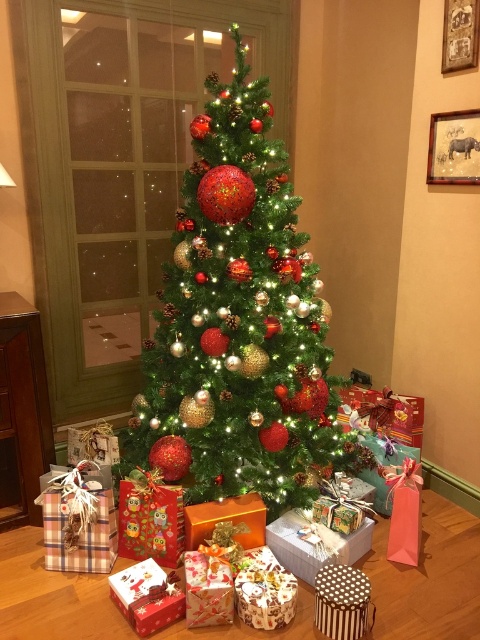
Question: Among these objects, which one is nearest to the camera?

Choices:
 (A) gold shiny gift at center
 (B) patterned paper gift at center
 (C) plaid fabric gift at lower left
 (D) shiny metallic tree at center

Answer: (B)

Question: Among these points, which one is nearest to the camera?

Choices:
 (A) (168, 620)
 (B) (123, 552)

Answer: (A)

Question: Is plaid fabric gift at lower left below patterned paper gift at center?

Choices:
 (A) no
 (B) yes

Answer: (A)

Question: Can you confirm if patterned paper gift at center is wider than gold shiny gift at center?

Choices:
 (A) yes
 (B) no

Answer: (B)

Question: Which of the following is the farthest from the observer?

Choices:
 (A) gold shiny gift at center
 (B) patterned paper gift at center
 (C) shiny metallic tree at center

Answer: (C)

Question: Does shiny metallic tree at center come behind plaid fabric gift at lower left?

Choices:
 (A) yes
 (B) no

Answer: (A)